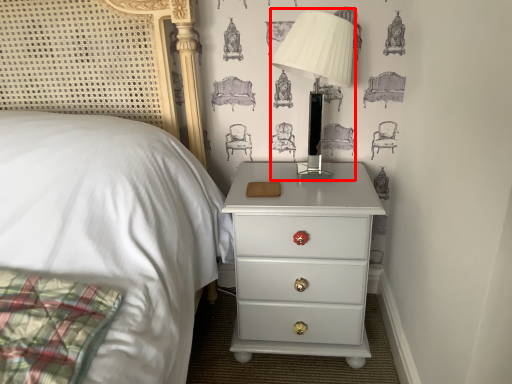
Question: From the image's perspective, what is the correct spatial positioning of table lamp (annotated by the red box) in reference to nightstand?

Choices:
 (A) above
 (B) below

Answer: (A)